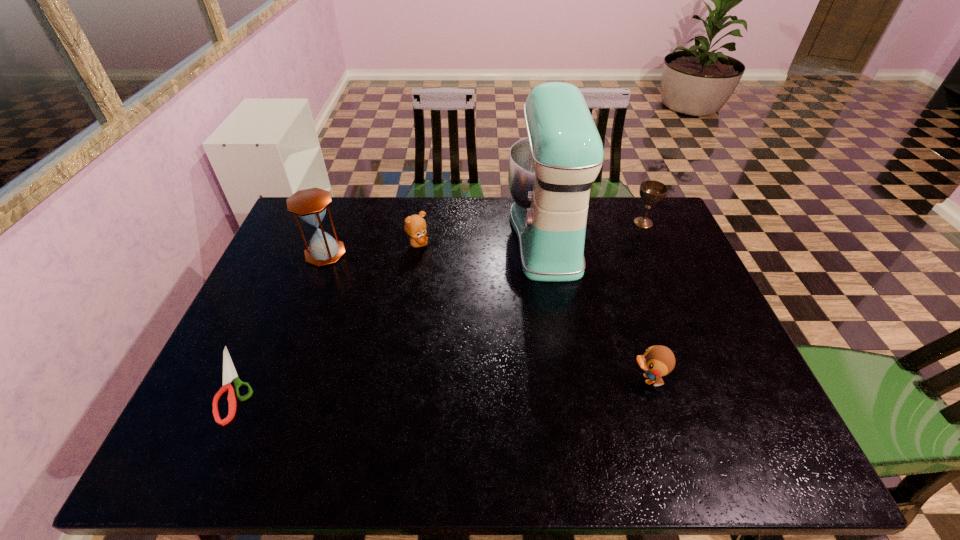
Where is `vacant area located at the base of the tallest object`? This screenshot has height=540, width=960. vacant area located at the base of the tallest object is located at coordinates (426, 235).

This screenshot has height=540, width=960. Find the location of `vacant space located 0.110m on the right of the fifth shortest object`. vacant space located 0.110m on the right of the fifth shortest object is located at coordinates (x=382, y=253).

In order to click on free point located 0.270m on the front of the rightmost object in this screenshot , I will do (672, 289).

This screenshot has height=540, width=960. I want to click on vacant space located on the face of the teddy bear, so click(453, 244).

You are a GUI agent. You are given a task and a screenshot of the screen. Output one action in this format:
    pyautogui.click(x=<x>, y=<y>)
    Task: Click on the free spot located on the front-facing side of the second object from right to left
    
    Given the screenshot: What is the action you would take?
    pyautogui.click(x=595, y=379)

Find the location of a particular element. This screenshot has height=540, width=960. vacant space located on the front-facing side of the second object from right to left is located at coordinates (464, 379).

Find the location of a particular element. vacant area situated on the front-facing side of the second object from right to left is located at coordinates (599, 379).

The image size is (960, 540). I want to click on free space located on the right of the shortest object, so click(407, 383).

Identify the location of mixer that is at the far edge. This screenshot has width=960, height=540. (551, 171).

The height and width of the screenshot is (540, 960). I want to click on hourglass present at the far edge, so click(x=310, y=205).